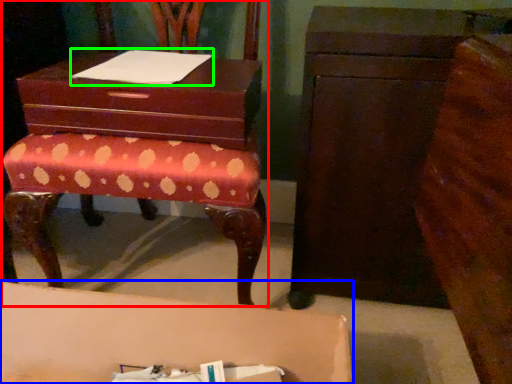
Question: Estimate the real-world distances between objects in this image. Which object is farther from furniture (highlighted by a red box), table (highlighted by a blue box) or book (highlighted by a green box)?

Choices:
 (A) table
 (B) book

Answer: (A)